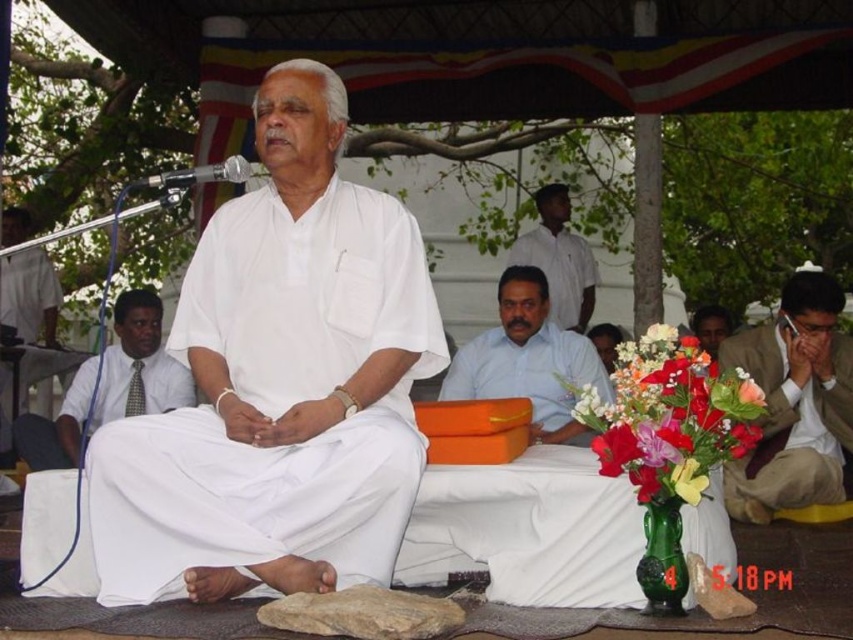
You are a photographer at the event and need to capture a closeup of the silky floral bouquet at center. The camera is currently focused on the microphone. To adjust the focus to the bouquet, should you move the focus point upwards or downwards?

Since the silky floral bouquet at center is located at point (670, 417), which is lower on the image plane compared to the microphone, you should move the focus point downwards to capture it.